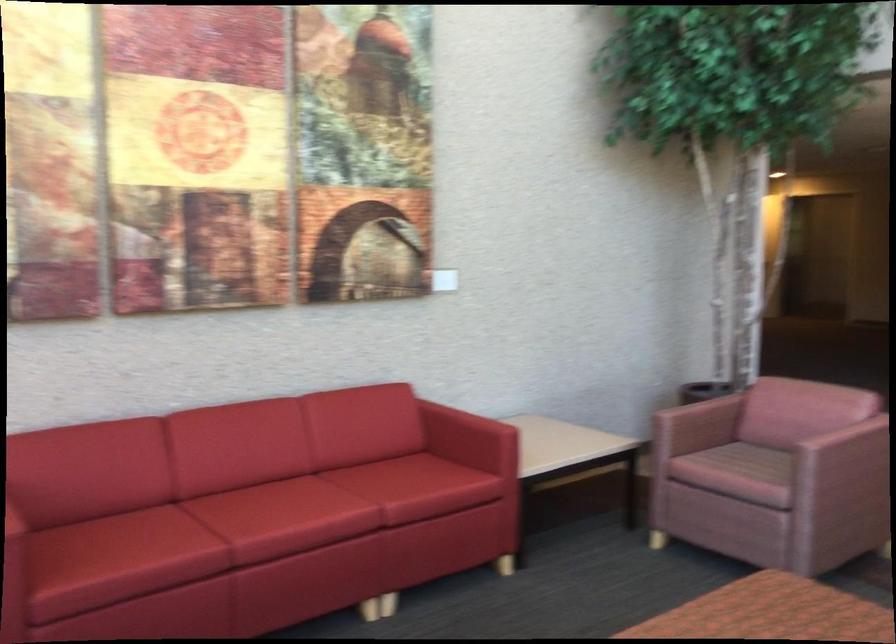
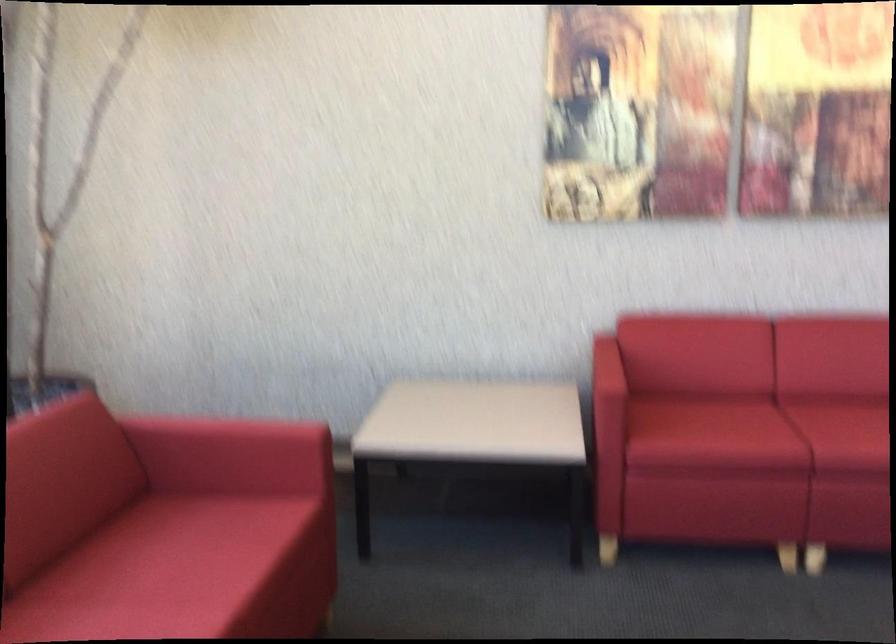
Find the pixel in the second image that matches point 174,545 in the first image.

(757, 431)